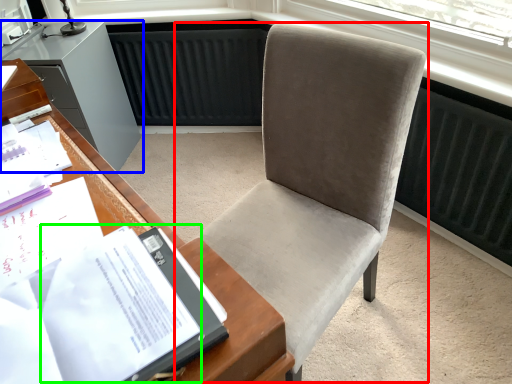
Question: Based on their relative distances, which object is farther from chair (highlighted by a red box)? Choose from cabinetry (highlighted by a blue box) and journal (highlighted by a green box).

Choices:
 (A) cabinetry
 (B) journal

Answer: (A)